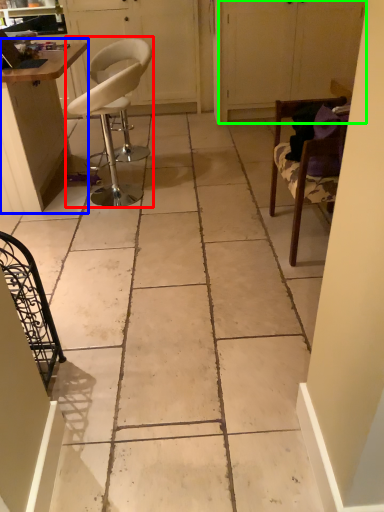
Question: Which object is the farthest from chair (highlighted by a red box)? Choose among these: table (highlighted by a blue box) or screen door (highlighted by a green box).

Choices:
 (A) table
 (B) screen door

Answer: (B)